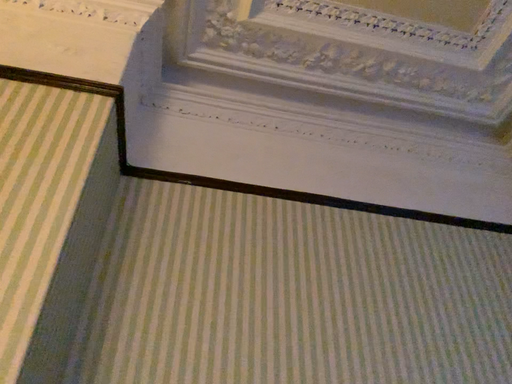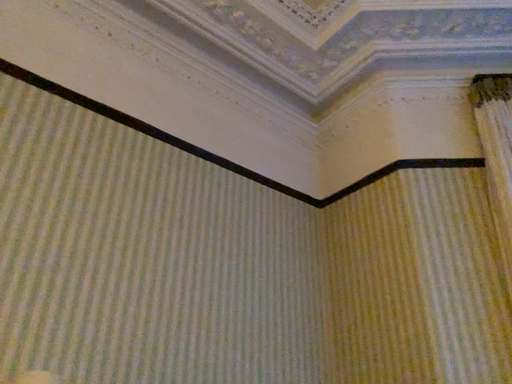
Question: How did the camera likely rotate when shooting the video?

Choices:
 (A) rotated right
 (B) rotated left

Answer: (A)